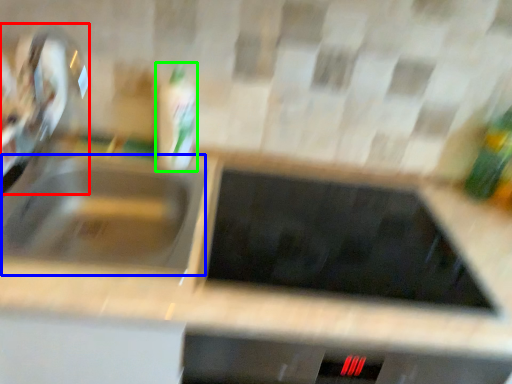
Question: Which object is the farthest from faucet (highlighted by a red box)? Choose among these: sink (highlighted by a blue box) or bottle (highlighted by a green box).

Choices:
 (A) sink
 (B) bottle

Answer: (B)